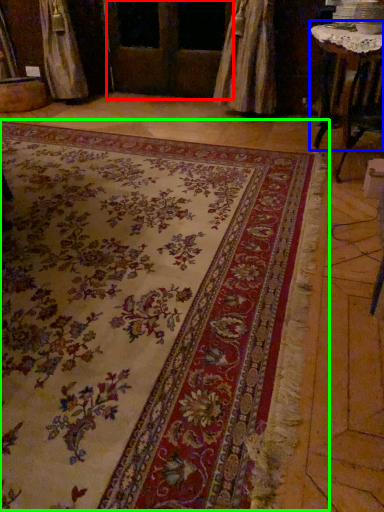
Question: Which is farther away from screen door (highlighted by a red box)? table (highlighted by a blue box) or mat (highlighted by a green box)?

Choices:
 (A) table
 (B) mat

Answer: (B)